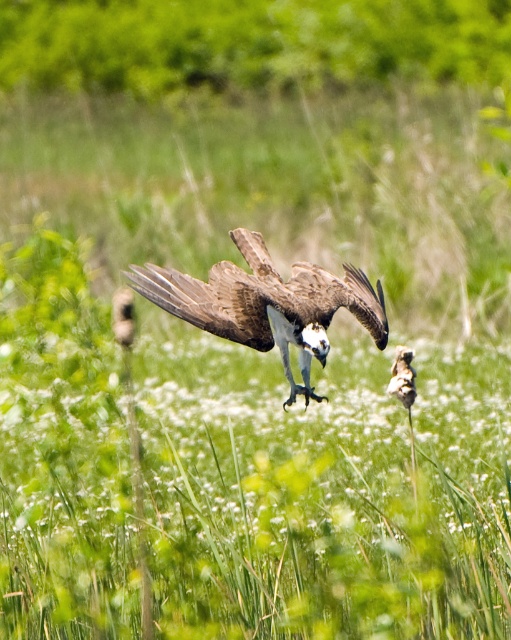
Can you confirm if brown textured eagle at center is bigger than brown speckled bird at center?

Yes.

Can you confirm if brown textured eagle at center is thinner than brown speckled bird at center?

No.

You are a GUI agent. You are given a task and a screenshot of the screen. Output one action in this format:
    pyautogui.click(x=<x>, y=<y>)
    Task: Click on the brown textured eagle at center
    Image resolution: width=511 pixels, height=640 pixels.
    Given the screenshot: What is the action you would take?
    pyautogui.click(x=267, y=304)